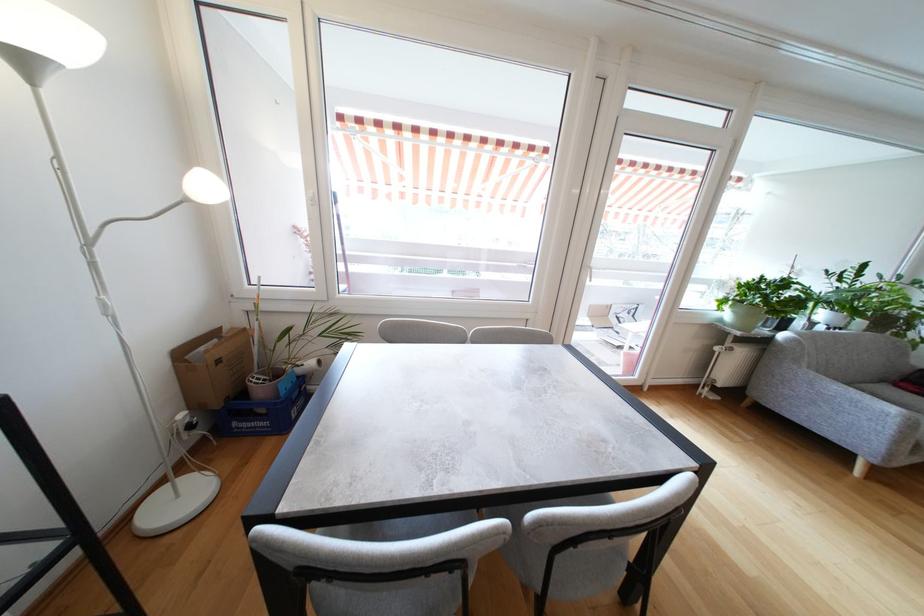
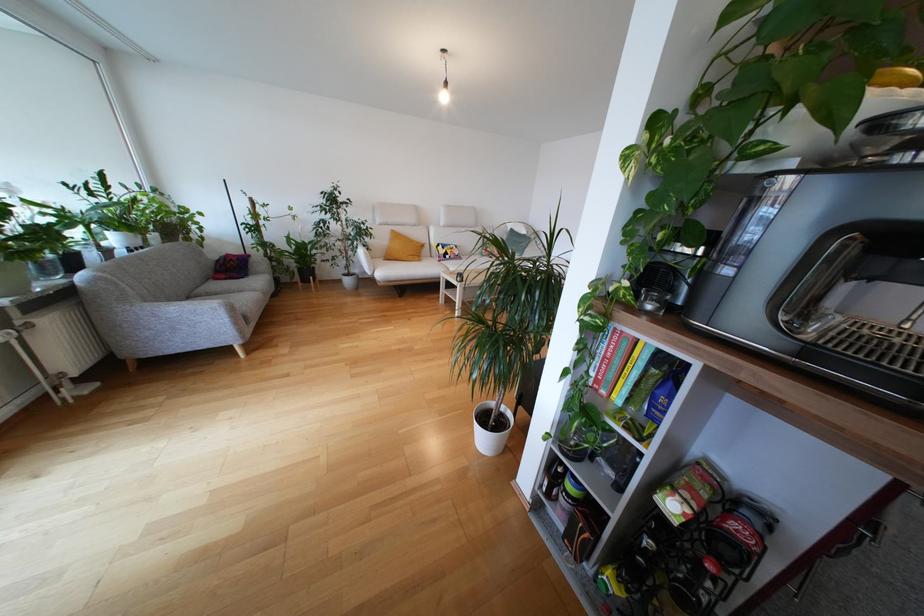
The first image is from the beginning of the video and the second image is from the end. How did the camera likely rotate when shooting the video?

The camera's rotation is toward right-down.